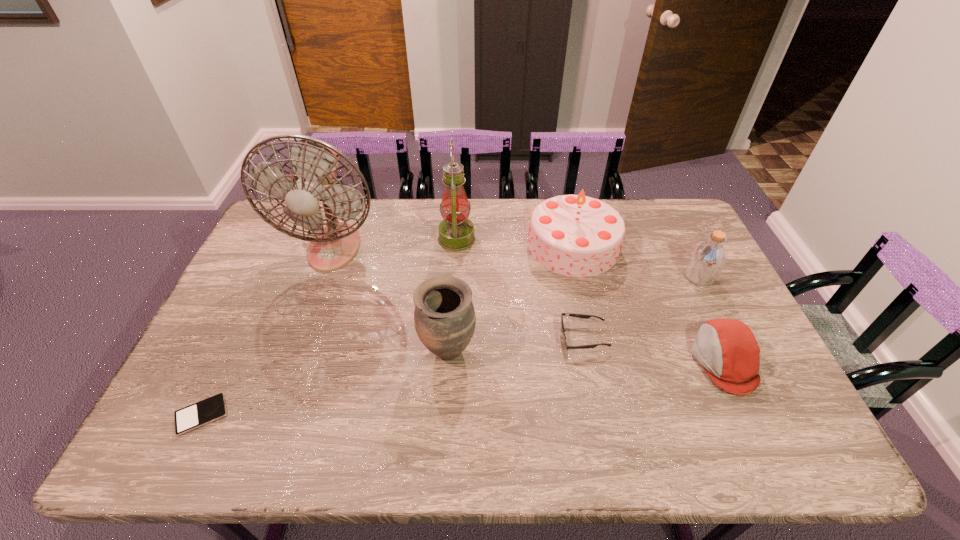
At what (x,y) coordinates should I click in order to perform the action: click on free space at the far edge. Please return your answer as a coordinate pair (x, y). This screenshot has height=540, width=960. Looking at the image, I should click on (429, 230).

This screenshot has height=540, width=960. What are the coordinates of `vacant space at the near edge of the desktop` in the screenshot? It's located at (722, 456).

What are the coordinates of `free space at the left edge` in the screenshot? It's located at (252, 287).

This screenshot has width=960, height=540. In the image, there is a desktop. Find the location of `vacant space at the right edge`. vacant space at the right edge is located at coordinates (710, 315).

Identify the location of free space at the far right corner. This screenshot has width=960, height=540. (655, 208).

This screenshot has width=960, height=540. Find the location of `vacant point located between the urn and the fan`. vacant point located between the urn and the fan is located at coordinates (391, 298).

You are a GUI agent. You are given a task and a screenshot of the screen. Output one action in this format:
    pyautogui.click(x=<x>, y=<y>)
    Task: Click on the free spot between the birthday cake and the seventh shortest object
    Image resolution: width=960 pixels, height=540 pixels.
    Given the screenshot: What is the action you would take?
    pyautogui.click(x=515, y=242)

Locate an element on the screen. The width and height of the screenshot is (960, 540). empty location between the urn and the birthday cake is located at coordinates (511, 298).

Image resolution: width=960 pixels, height=540 pixels. I want to click on free space between the urn and the sunglasses, so click(x=516, y=343).

This screenshot has width=960, height=540. I want to click on free space between the birthday cake and the shortest object, so click(x=388, y=330).